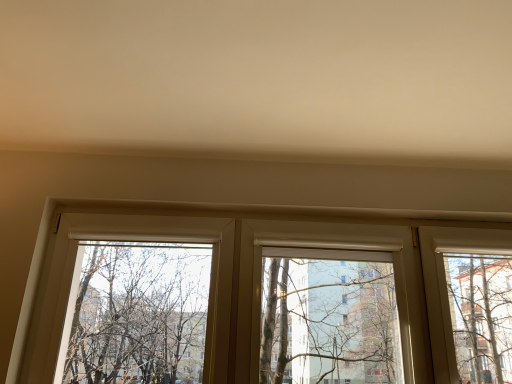
What do you see at coordinates (243, 278) in the screenshot? This screenshot has height=384, width=512. I see `white plastic window at center` at bounding box center [243, 278].

Find the location of a particular element. This screenshot has width=512, height=384. white plastic window at center is located at coordinates (243, 278).

The height and width of the screenshot is (384, 512). I want to click on white plastic window at center, so click(243, 278).